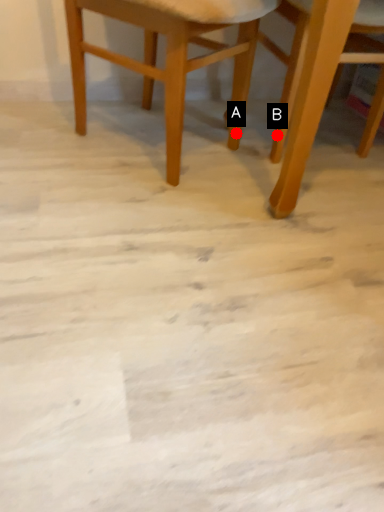
Question: Two points are circled on the image, labeled by A and B beside each circle. Which point is closer to the camera?

Choices:
 (A) A is closer
 (B) B is closer

Answer: (B)